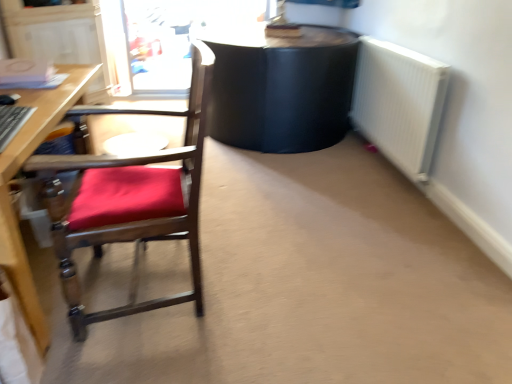
Question: From a real-world perspective, is transparent plastic screen door at upper left on wooden chair with red cushion at left?

Choices:
 (A) no
 (B) yes

Answer: (B)

Question: Considering the relative sizes of transparent plastic screen door at upper left and wooden chair with red cushion at left in the image provided, is transparent plastic screen door at upper left taller than wooden chair with red cushion at left?

Choices:
 (A) yes
 (B) no

Answer: (B)

Question: Can you confirm if transparent plastic screen door at upper left is thinner than wooden chair with red cushion at left?

Choices:
 (A) no
 (B) yes

Answer: (B)

Question: From a real-world perspective, does transparent plastic screen door at upper left sit lower than wooden chair with red cushion at left?

Choices:
 (A) no
 (B) yes

Answer: (A)

Question: Is transparent plastic screen door at upper left outside of wooden chair with red cushion at left?

Choices:
 (A) yes
 (B) no

Answer: (A)

Question: Is point (x=411, y=59) closer or farther from the camera than point (x=141, y=177)?

Choices:
 (A) closer
 (B) farther

Answer: (B)

Question: From the image's perspective, is white metallic radiator at right positioned above or below wooden chair with red cushion at left?

Choices:
 (A) above
 (B) below

Answer: (A)

Question: Is white metallic radiator at right inside or outside of wooden chair with red cushion at left?

Choices:
 (A) inside
 (B) outside

Answer: (B)

Question: Looking at their shapes, would you say white metallic radiator at right is wider or thinner than wooden chair with red cushion at left?

Choices:
 (A) thin
 (B) wide

Answer: (A)

Question: Considering the positions of wooden chair with red cushion at left and transparent plastic screen door at upper left in the image, is wooden chair with red cushion at left wider or thinner than transparent plastic screen door at upper left?

Choices:
 (A) wide
 (B) thin

Answer: (A)

Question: Considering the relative positions of wooden chair with red cushion at left and transparent plastic screen door at upper left in the image provided, is wooden chair with red cushion at left to the left or to the right of transparent plastic screen door at upper left?

Choices:
 (A) right
 (B) left

Answer: (A)

Question: Do you think wooden chair with red cushion at left is within transparent plastic screen door at upper left, or outside of it?

Choices:
 (A) outside
 (B) inside

Answer: (A)

Question: From the image's perspective, is wooden chair with red cushion at left located above or below transparent plastic screen door at upper left?

Choices:
 (A) below
 (B) above

Answer: (A)

Question: Considering their positions, is transparent plastic screen door at upper left located in front of or behind wooden chair with red cushion at left?

Choices:
 (A) front
 (B) behind

Answer: (B)

Question: Considering the positions of point (135, 8) and point (116, 175), is point (135, 8) closer or farther from the camera than point (116, 175)?

Choices:
 (A) farther
 (B) closer

Answer: (A)